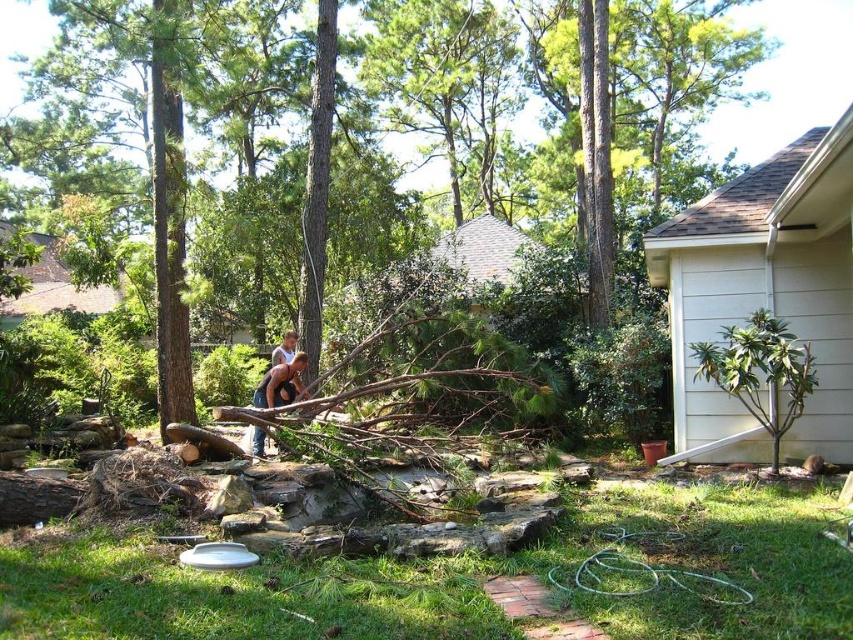
Question: Among these points, which one is farthest from the camera?

Choices:
 (A) (618, 113)
 (B) (299, 358)

Answer: (A)

Question: Is brown leather boots at center above brown rough wood at center?

Choices:
 (A) no
 (B) yes

Answer: (A)

Question: Is brown leather boots at center bigger than brown rough wood at center?

Choices:
 (A) yes
 (B) no

Answer: (B)

Question: Does brown leather boots at center appear over brown rough wood at center?

Choices:
 (A) yes
 (B) no

Answer: (B)